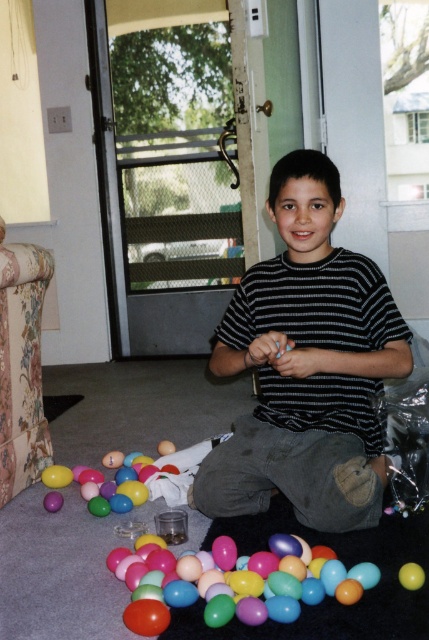
Does glossy plastic eggs at lower center have a lesser height compared to glossy plastic eggs at lower left?

No, glossy plastic eggs at lower center is not shorter than glossy plastic eggs at lower left.

In the scene shown: Is the position of glossy plastic eggs at lower center less distant than that of glossy plastic eggs at lower left?

Yes, it is in front of glossy plastic eggs at lower left.

Find the location of a particular element. The height and width of the screenshot is (640, 429). glossy plastic eggs at lower center is located at coordinates (233, 584).

The image size is (429, 640). I want to click on glossy plastic eggs at lower center, so click(x=233, y=584).

Is black striped shirt at center wider than glossy plastic eggs at lower left?

Yes.

Who is positioned more to the right, black striped shirt at center or glossy plastic eggs at lower left?

Positioned to the right is black striped shirt at center.

Does point (310, 304) lie behind point (111, 451)?

No, it is not.

Where is `black striped shirt at center`? This screenshot has width=429, height=640. black striped shirt at center is located at coordinates (307, 365).

Is black striped shirt at center bigger than smooth yellow ball at lower right?

Indeed, black striped shirt at center has a larger size compared to smooth yellow ball at lower right.

Can you confirm if black striped shirt at center is wider than smooth yellow ball at lower right?

Indeed, black striped shirt at center has a greater width compared to smooth yellow ball at lower right.

The image size is (429, 640). I want to click on black striped shirt at center, so click(x=307, y=365).